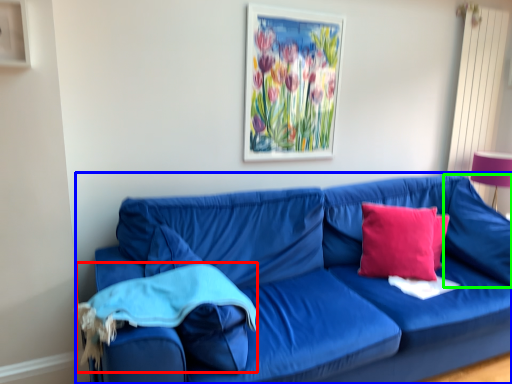
Question: Which object is positioned closest to material (highlighted by a red box)? Select from studio couch (highlighted by a blue box) and pillow (highlighted by a green box).

Choices:
 (A) studio couch
 (B) pillow

Answer: (A)